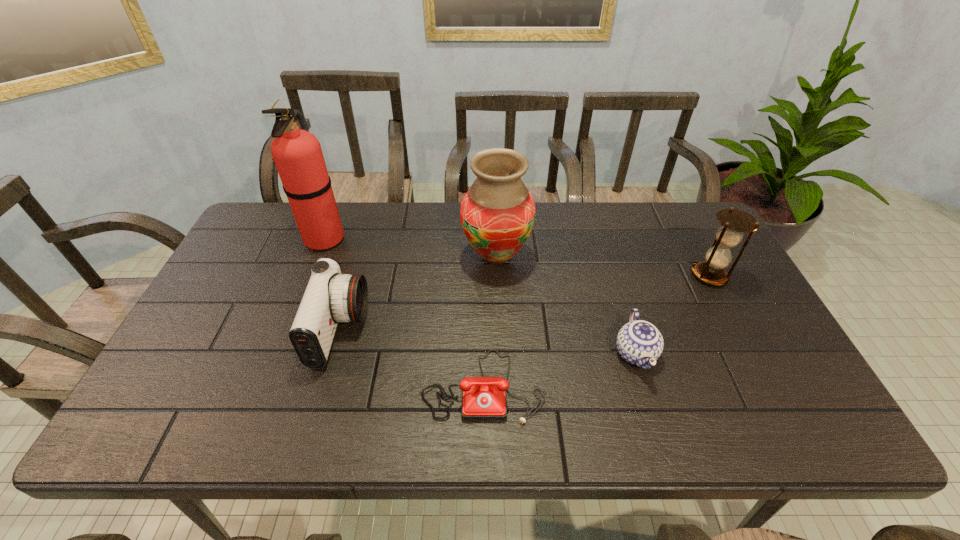
This screenshot has height=540, width=960. Find the location of `fire extinguisher`. fire extinguisher is located at coordinates (297, 154).

Where is `the tallest object`? The height and width of the screenshot is (540, 960). the tallest object is located at coordinates (297, 154).

Identify the location of vase. (497, 214).

Find the location of a particular element. the rightmost object is located at coordinates (735, 222).

Where is `the fourth shortest object`? This screenshot has height=540, width=960. the fourth shortest object is located at coordinates (735, 222).

Where is `the second object from left to right`? Image resolution: width=960 pixels, height=540 pixels. the second object from left to right is located at coordinates click(x=330, y=297).

Locate an element on the screen. Image resolution: width=960 pixels, height=540 pixels. the fourth tallest object is located at coordinates (330, 297).

Where is `chinaware`? Image resolution: width=960 pixels, height=540 pixels. chinaware is located at coordinates (639, 342).

Where is `the second object from right to left`? the second object from right to left is located at coordinates pyautogui.click(x=639, y=342).

Where is `the shortest object`? The height and width of the screenshot is (540, 960). the shortest object is located at coordinates (483, 398).